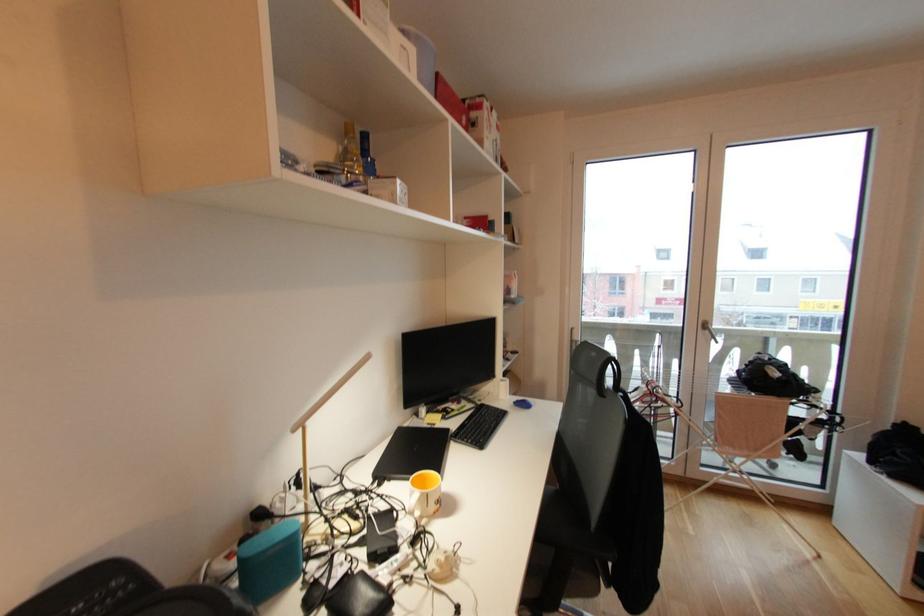
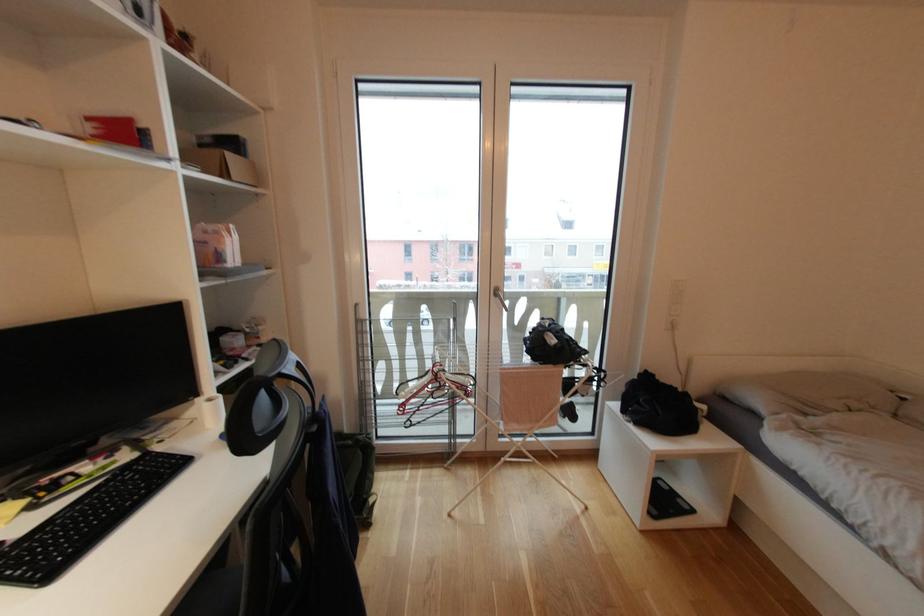
Question: How did the camera likely rotate?

Choices:
 (A) Left
 (B) Right
 (C) Up
 (D) Down

Answer: (B)